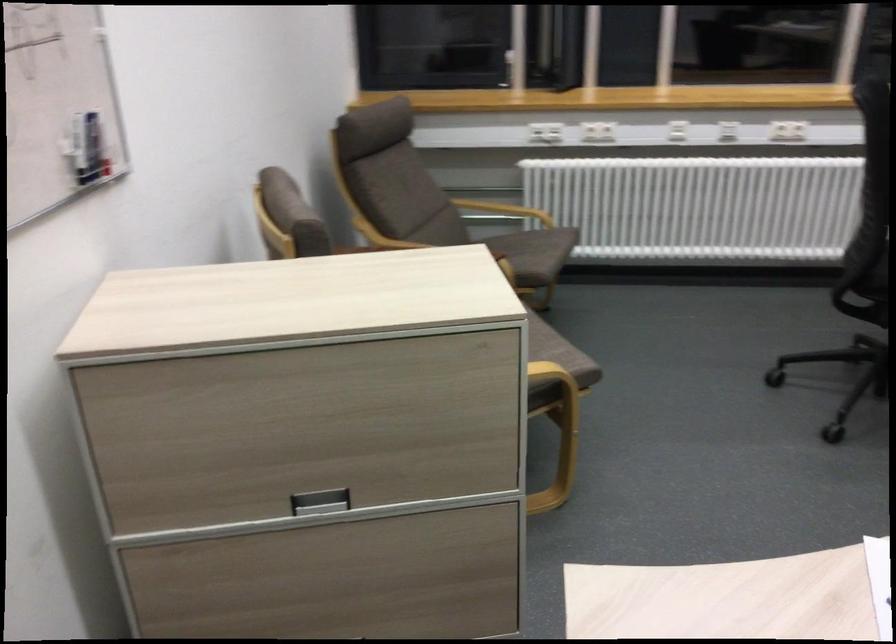
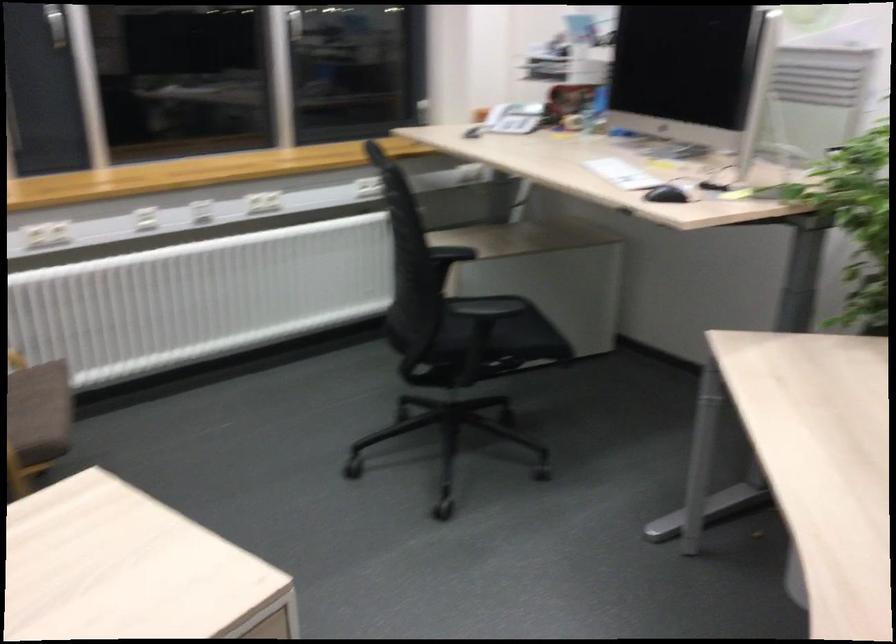
Question: The first image is from the beginning of the video and the second image is from the end. How did the camera likely rotate when shooting the video?

Choices:
 (A) Left
 (B) Right
 (C) Up
 (D) Down

Answer: (B)